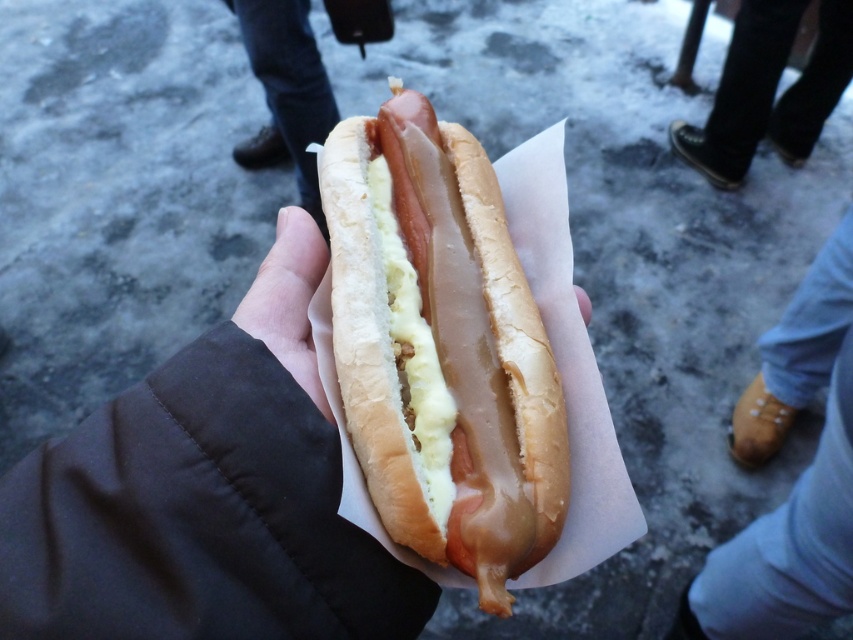
Question: Which is nearer to the black leather shoes at lower right?

Choices:
 (A) slightly toasted bun at center
 (B) white smooth skin at center
 (C) brown leather shoe at lower center
 (D) brown leather shoe at lower right

Answer: (D)

Question: Does black leather shoes at lower right appear under brown leather shoe at lower center?

Choices:
 (A) no
 (B) yes

Answer: (B)

Question: Considering the real-world distances, which object is farthest from the brown leather shoe at lower right?

Choices:
 (A) black leather shoes at lower right
 (B) brown leather shoe at lower center

Answer: (B)

Question: Can you confirm if slightly toasted bun at center is positioned to the right of brown leather shoe at lower right?

Choices:
 (A) yes
 (B) no

Answer: (B)

Question: Does slightly toasted bun at center appear on the right side of brown leather shoe at lower center?

Choices:
 (A) yes
 (B) no

Answer: (A)

Question: Which object is closer to the camera taking this photo?

Choices:
 (A) black leather shoes at lower right
 (B) brown leather shoe at lower center

Answer: (A)